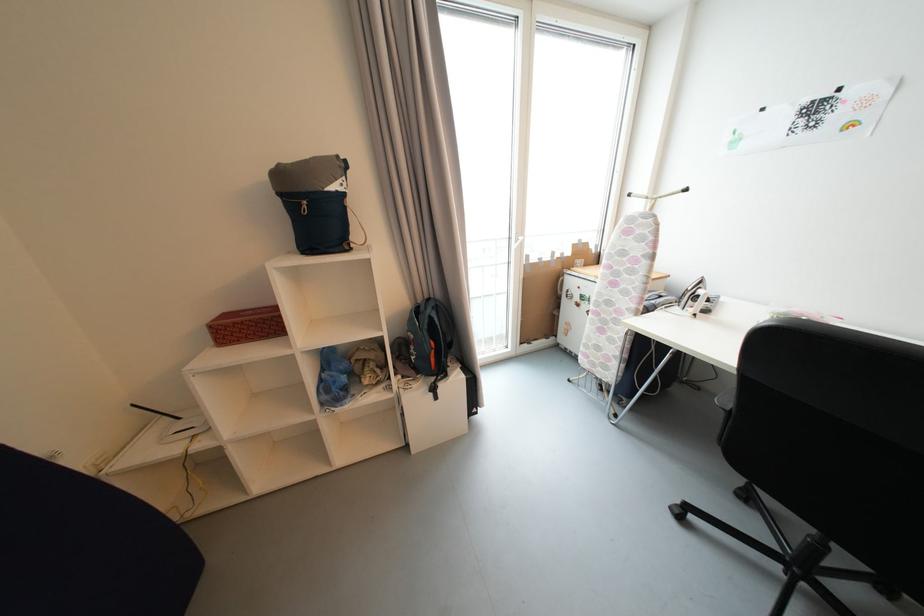
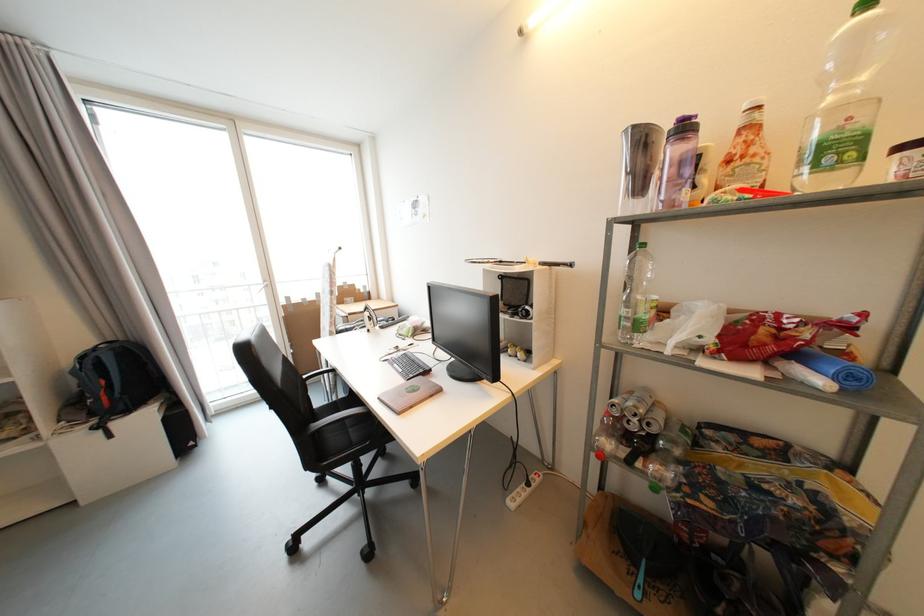
Where in the second image is the point corresponding to the point at 439,391 from the first image?

(104, 429)